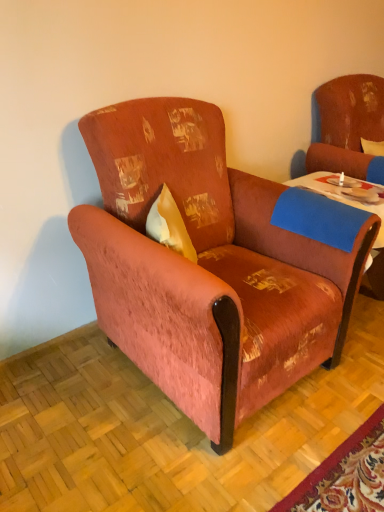
Question: Can you confirm if velvet-like rust-colored armchair at center is wider than distressed fabric swivel chair at upper right?

Choices:
 (A) yes
 (B) no

Answer: (A)

Question: Can you confirm if velvet-like rust-colored armchair at center is bigger than distressed fabric swivel chair at upper right?

Choices:
 (A) no
 (B) yes

Answer: (B)

Question: Can you see velvet-like rust-colored armchair at center touching distressed fabric swivel chair at upper right?

Choices:
 (A) no
 (B) yes

Answer: (A)

Question: Can distressed fabric swivel chair at upper right be found inside velvet-like rust-colored armchair at center?

Choices:
 (A) yes
 (B) no

Answer: (B)

Question: Is velvet-like rust-colored armchair at center smaller than distressed fabric swivel chair at upper right?

Choices:
 (A) yes
 (B) no

Answer: (B)

Question: In the image, is velvet-like rust-colored armchair at center on the left side or the right side of distressed fabric swivel chair at upper right?

Choices:
 (A) left
 (B) right

Answer: (A)

Question: In terms of height, does velvet-like rust-colored armchair at center look taller or shorter compared to distressed fabric swivel chair at upper right?

Choices:
 (A) short
 (B) tall

Answer: (B)

Question: In the image, is velvet-like rust-colored armchair at center positioned in front of or behind distressed fabric swivel chair at upper right?

Choices:
 (A) front
 (B) behind

Answer: (A)

Question: Is velvet-like rust-colored armchair at center spatially inside distressed fabric swivel chair at upper right, or outside of it?

Choices:
 (A) outside
 (B) inside

Answer: (A)

Question: Is velvet-like rust-colored armchair at center wider or thinner than blue felt table at center?

Choices:
 (A) wide
 (B) thin

Answer: (A)

Question: Based on their positions, is velvet-like rust-colored armchair at center located to the left or right of blue felt table at center?

Choices:
 (A) left
 (B) right

Answer: (A)

Question: Relative to blue felt table at center, is velvet-like rust-colored armchair at center in front or behind?

Choices:
 (A) front
 (B) behind

Answer: (A)

Question: From the image's perspective, is velvet-like rust-colored armchair at center located above or below blue felt table at center?

Choices:
 (A) above
 (B) below

Answer: (B)

Question: Does point (317, 180) appear closer or farther from the camera than point (324, 151)?

Choices:
 (A) farther
 (B) closer

Answer: (B)

Question: In terms of height, does blue felt table at center look taller or shorter compared to distressed fabric swivel chair at upper right?

Choices:
 (A) short
 (B) tall

Answer: (A)